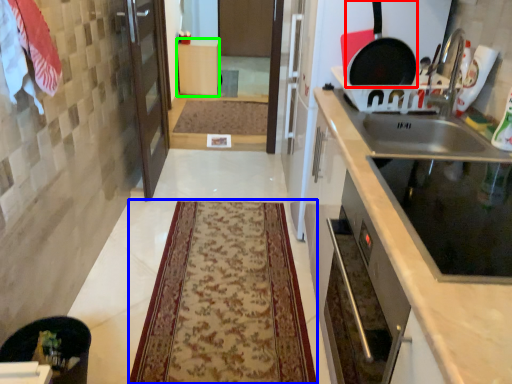
Question: Estimate the real-world distances between objects in this image. Which object is closer to frying pan (highlighted by a red box), mat (highlighted by a blue box) or cabinetry (highlighted by a green box)?

Choices:
 (A) mat
 (B) cabinetry

Answer: (A)